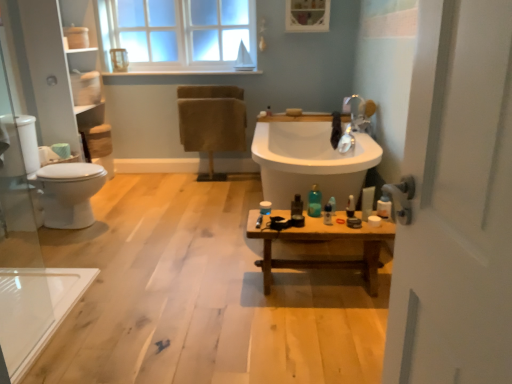
The image size is (512, 384). What are the coordinates of `free space in front of beige fabric chair at upper center` in the screenshot? It's located at (221, 187).